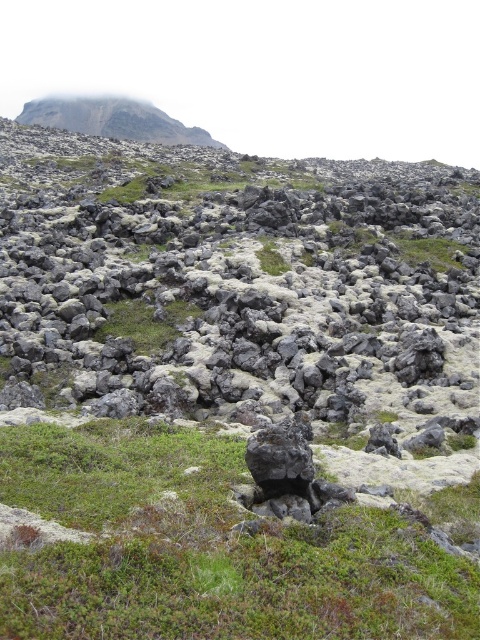
You are a hiker planning to cross the volcanic landscape. You see the rugged stone hillside at upper left and the green grassy at center. Which terrain would be easier to walk on?

The green grassy at center would be easier to walk on because the rugged stone hillside at upper left is positioned over it, suggesting the grassy area is lower and possibly flatter.